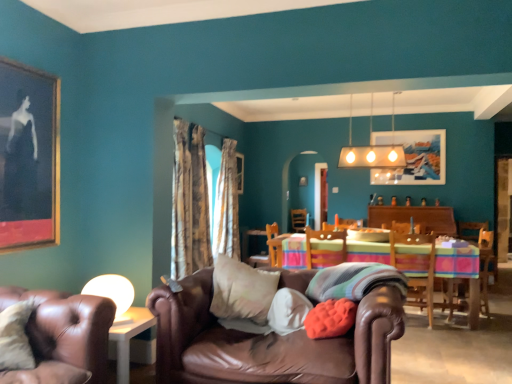
This screenshot has height=384, width=512. I want to click on free point above gold-framed painting at upper left, the 3th picture frame viewed from the back (from a real-world perspective), so click(x=26, y=66).